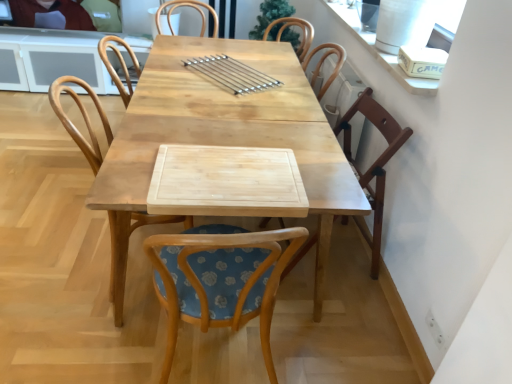
Identify the location of free region under wooden chair at right, positioned as the third chair in left-to-right order (from a real-world perspective). tap(341, 253).